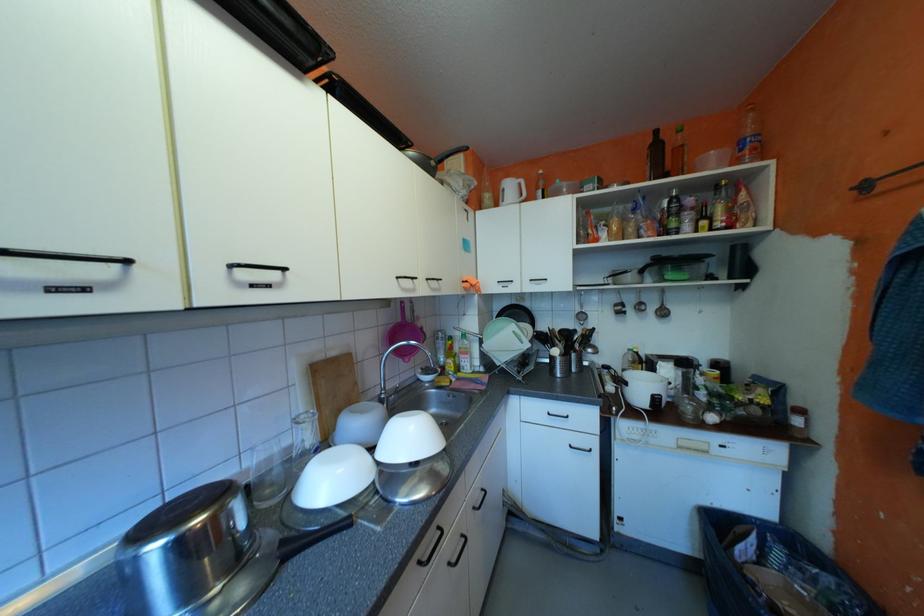
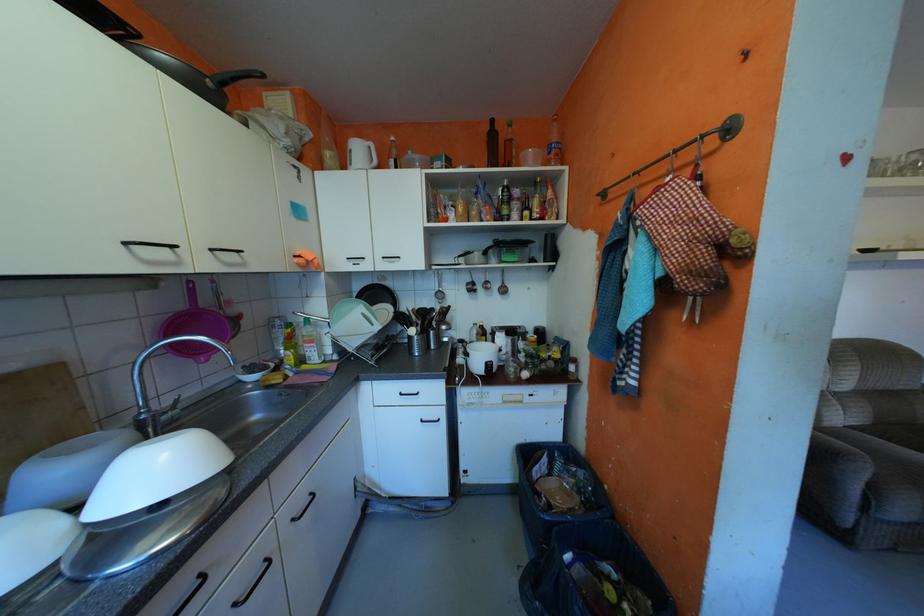
Question: The first image is from the beginning of the video and the second image is from the end. How did the camera likely rotate when shooting the video?

Choices:
 (A) Left
 (B) Right
 (C) Up
 (D) Down

Answer: (B)